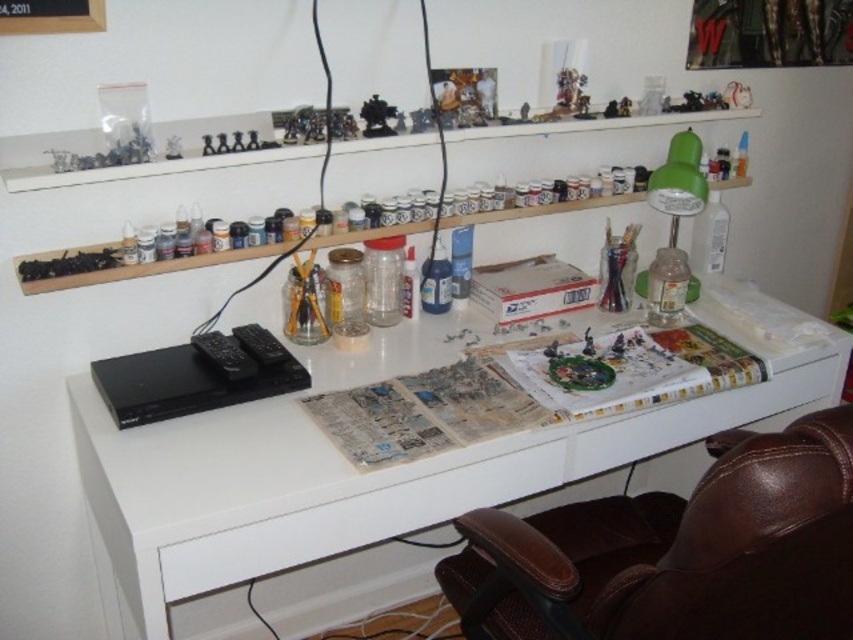
You are standing in front of a desk and want to place a 1.2 meter long object on the white matte computer desk at center. Can you fit it on the desk?

The white matte computer desk at center is 1.04 meters away from viewer, but the question is about the desk dimensions. Since the distance from the viewer doesn not indicate the desk size, we cannot determine if the 1.2 meter object will fit. More information about the desk dimensions is needed.

You are sitting in the brown leather swivel chair at lower right and want to reach the items on the white matte computer desk at center. Which direction should you move to get closer to the desk?

You should move forward because the white matte computer desk at center is above the brown leather swivel chair at lower right, indicating it is closer to you.